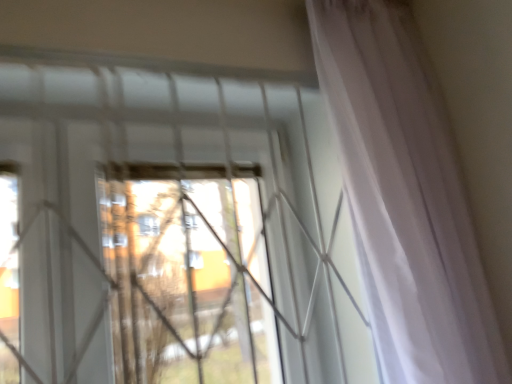
What do you see at coordinates (172, 227) in the screenshot? The width and height of the screenshot is (512, 384). I see `clear glass window at center` at bounding box center [172, 227].

Measure the distance between clear glass window at center and camera.

The depth of clear glass window at center is 30.02 inches.

Where is `clear glass window at center`? Image resolution: width=512 pixels, height=384 pixels. clear glass window at center is located at coordinates (172, 227).

At what (x,y) coordinates should I click in order to perform the action: click on clear glass window at center. Please return your answer as a coordinate pair (x, y). Looking at the image, I should click on (172, 227).